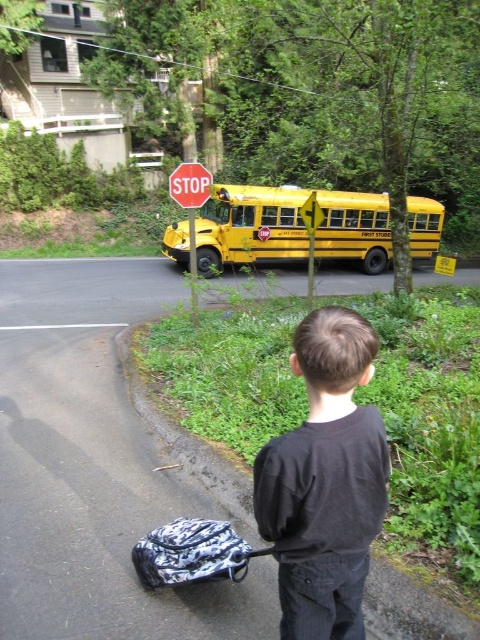
Is point (292, 502) positioned before point (316, 221)?

Yes.

Can you confirm if black cotton shirt at center is wider than metallic yellow bus at center?

Yes, black cotton shirt at center is wider than metallic yellow bus at center.

Who is more distant from viewer, (375, 426) or (303, 216)?

Positioned behind is point (303, 216).

Identify the location of black cotton shirt at center. (324, 481).

Based on the photo, between red plastic stop sign at center and metallic yellow bus at center, which one appears on the left side from the viewer's perspective?

From the viewer's perspective, red plastic stop sign at center appears more on the left side.

Between red plastic stop sign at center and metallic yellow bus at center, which one is positioned higher?

red plastic stop sign at center

Does point (200, 202) come closer to viewer compared to point (310, 205)?

Yes, it is in front of point (310, 205).

At what (x,y) coordinates should I click in order to perform the action: click on red plastic stop sign at center. Please return your answer as a coordinate pair (x, y). This screenshot has width=480, height=640. Looking at the image, I should click on (190, 184).

Can you confirm if yellow metallic bus at center is taller than red plastic stop sign at center?

Yes, yellow metallic bus at center is taller than red plastic stop sign at center.

Does yellow metallic bus at center have a lesser width compared to red plastic stop sign at center?

No, yellow metallic bus at center is not thinner than red plastic stop sign at center.

Does point (298, 244) come behind point (180, 202)?

Yes, it is.

The width and height of the screenshot is (480, 640). I want to click on yellow metallic bus at center, so click(250, 227).